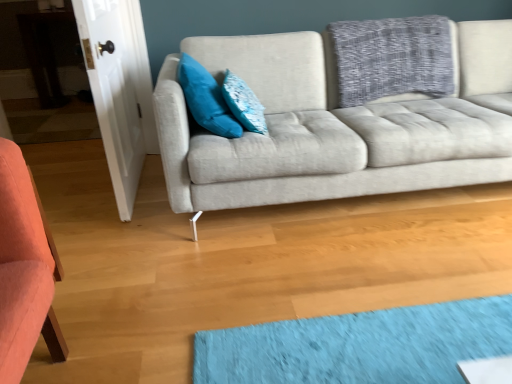
Question: Is point (257, 117) positioned closer to the camera than point (190, 74)?

Choices:
 (A) closer
 (B) farther

Answer: (B)

Question: In terms of width, does textured blue pillow at center, acting as the 1th pillow starting from the right, look wider or thinner when compared to teal velvet pillow at upper left, the first pillow from the left?

Choices:
 (A) thin
 (B) wide

Answer: (A)

Question: Considering the real-world distances, which object is farthest from the teal velvet pillow at upper left, the first pillow from the left?

Choices:
 (A) light gray fabric couch at center
 (B) white wood door at left
 (C) textured blue pillow at center, acting as the 1th pillow starting from the right

Answer: (B)

Question: Which of these objects is positioned farthest from the teal velvet pillow at upper left, placed as the second pillow when sorted from right to left?

Choices:
 (A) white wood door at left
 (B) light gray fabric couch at center
 (C) textured blue pillow at center, the 2th pillow positioned from the left

Answer: (A)